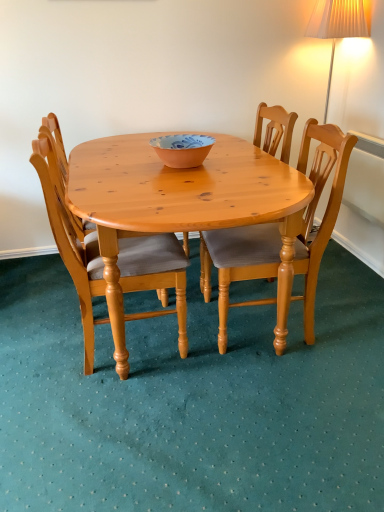
Question: From a real-world perspective, is pine wood chair at center, which is the third chair from right to left, located beneath wooden chair at center, which is the second chair in left-to-right order?

Choices:
 (A) yes
 (B) no

Answer: (A)

Question: Can you confirm if pine wood chair at center, which is the third chair from right to left, is wider than wooden chair at center, which is the second chair in left-to-right order?

Choices:
 (A) no
 (B) yes

Answer: (A)

Question: From the image's perspective, is pine wood chair at center, the 1th chair when ordered from left to right, above wooden chair at center, which is the second chair in left-to-right order?

Choices:
 (A) no
 (B) yes

Answer: (A)

Question: Is pine wood chair at center, the 1th chair when ordered from left to right, closer to camera compared to wooden chair at center, which is the second chair in left-to-right order?

Choices:
 (A) yes
 (B) no

Answer: (A)

Question: Considering the relative sizes of pine wood chair at center, the 1th chair when ordered from left to right, and wooden chair at center, which is the second chair in left-to-right order, in the image provided, is pine wood chair at center, the 1th chair when ordered from left to right, bigger than wooden chair at center, which is the second chair in left-to-right order,?

Choices:
 (A) no
 (B) yes

Answer: (A)

Question: Is pine wood chair at center, the 1th chair when ordered from left to right, looking in the opposite direction of wooden chair at center, which is the second chair in left-to-right order?

Choices:
 (A) yes
 (B) no

Answer: (B)

Question: Does light brown wooden chair at center, arranged as the 1th chair when viewed from the right, come behind pine wood chair at center, which is the third chair from right to left?

Choices:
 (A) yes
 (B) no

Answer: (A)

Question: From a real-world perspective, is light brown wooden chair at center, positioned as the 3th chair in left-to-right order, located higher than pine wood chair at center, the 1th chair when ordered from left to right?

Choices:
 (A) no
 (B) yes

Answer: (B)

Question: Is light brown wooden chair at center, arranged as the 1th chair when viewed from the right, at the right side of pine wood chair at center, which is the third chair from right to left?

Choices:
 (A) yes
 (B) no

Answer: (A)

Question: Is light brown wooden chair at center, arranged as the 1th chair when viewed from the right, thinner than pine wood chair at center, the 1th chair when ordered from left to right?

Choices:
 (A) no
 (B) yes

Answer: (A)

Question: Is light brown wooden chair at center, positioned as the 3th chair in left-to-right order, smaller than pine wood chair at center, the 1th chair when ordered from left to right?

Choices:
 (A) no
 (B) yes

Answer: (B)

Question: Is light brown wooden chair at center, arranged as the 1th chair when viewed from the right, oriented towards pine wood chair at center, which is the third chair from right to left?

Choices:
 (A) yes
 (B) no

Answer: (A)

Question: Is light brown wooden chair at center, arranged as the 1th chair when viewed from the right, oriented away from matte orange bowl at center?

Choices:
 (A) yes
 (B) no

Answer: (B)